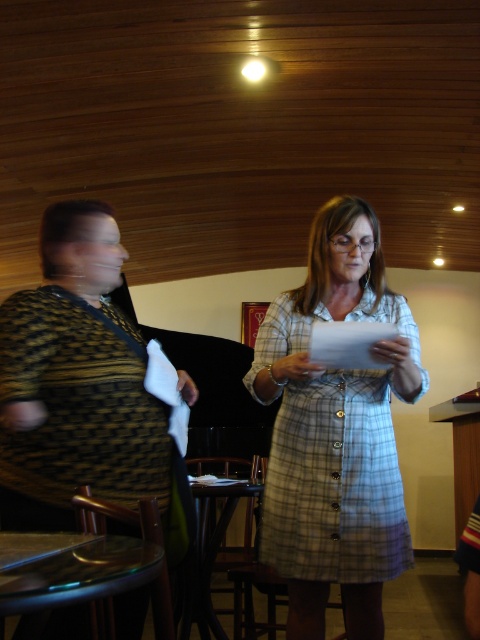
Is point (112, 307) positioned in front of point (348, 336)?

No, it is behind (348, 336).

Looking at this image, is patterned fabric dress at left closer to camera compared to white paper at center?

Yes, patterned fabric dress at left is in front of white paper at center.

Which is in front, point (72, 634) or point (359, 332)?

Point (72, 634)

Find the location of `patterned fabric dress at left`. patterned fabric dress at left is located at coordinates (74, 381).

Does plaid cotton dress at center have a greater height compared to white paper at center?

Yes.

In the scene shown: Which is above, plaid cotton dress at center or white paper at center?

Positioned higher is white paper at center.

This screenshot has width=480, height=640. What do you see at coordinates (336, 432) in the screenshot? I see `plaid cotton dress at center` at bounding box center [336, 432].

Locate an element on the screen. The height and width of the screenshot is (640, 480). plaid cotton dress at center is located at coordinates (336, 432).

Find the location of a particular element. Image resolution: width=480 pixels, height=640 pixels. plaid cotton dress at center is located at coordinates (336, 432).

Between plaid cotton dress at center and patterned fabric dress at left, which one has less height?

patterned fabric dress at left

This screenshot has height=640, width=480. I want to click on plaid cotton dress at center, so (336, 432).

This screenshot has width=480, height=640. Find the location of `plaid cotton dress at center`. plaid cotton dress at center is located at coordinates (336, 432).